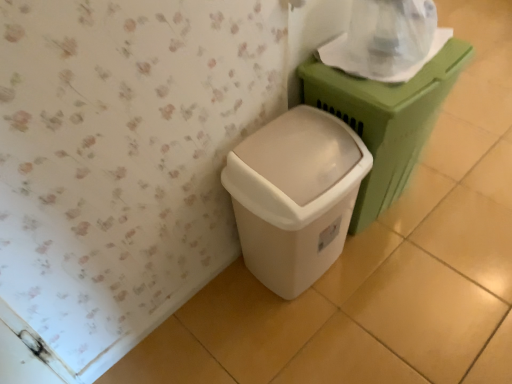
Question: Which direction should I rotate to look at white plastic waste container at lower center, the second waste container viewed from the right?

Choices:
 (A) left
 (B) right

Answer: (B)

Question: Considering the relative positions of transparent plastic toilet paper at upper right and matte green plastic at right, positioned as the 1th waste container in right-to-left order, in the image provided, is transparent plastic toilet paper at upper right to the right of matte green plastic at right, positioned as the 1th waste container in right-to-left order, from the viewer's perspective?

Choices:
 (A) yes
 (B) no

Answer: (B)

Question: Considering the relative sizes of transparent plastic toilet paper at upper right and matte green plastic at right, positioned as the 1th waste container in right-to-left order, in the image provided, is transparent plastic toilet paper at upper right shorter than matte green plastic at right, positioned as the 1th waste container in right-to-left order,?

Choices:
 (A) yes
 (B) no

Answer: (A)

Question: From a real-world perspective, is transparent plastic toilet paper at upper right located beneath matte green plastic at right, positioned as the 1th waste container in right-to-left order?

Choices:
 (A) yes
 (B) no

Answer: (B)

Question: From a real-world perspective, does transparent plastic toilet paper at upper right stand above matte green plastic at right, the 2th waste container from the left?

Choices:
 (A) no
 (B) yes

Answer: (B)

Question: Is transparent plastic toilet paper at upper right further to the viewer compared to matte green plastic at right, the 2th waste container from the left?

Choices:
 (A) no
 (B) yes

Answer: (B)

Question: Is transparent plastic toilet paper at upper right wider than matte green plastic at right, positioned as the 1th waste container in right-to-left order?

Choices:
 (A) yes
 (B) no

Answer: (B)

Question: Can we say white plastic waste container at lower center, the second waste container viewed from the right, lies outside transparent plastic toilet paper at upper right?

Choices:
 (A) no
 (B) yes

Answer: (B)

Question: From the image's perspective, is white plastic waste container at lower center, arranged as the first waste container when viewed from the left, on top of transparent plastic toilet paper at upper right?

Choices:
 (A) no
 (B) yes

Answer: (A)

Question: Is white plastic waste container at lower center, arranged as the first waste container when viewed from the left, far from transparent plastic toilet paper at upper right?

Choices:
 (A) yes
 (B) no

Answer: (B)

Question: Is white plastic waste container at lower center, the second waste container viewed from the right, taller than transparent plastic toilet paper at upper right?

Choices:
 (A) yes
 (B) no

Answer: (A)

Question: Does white plastic waste container at lower center, the second waste container viewed from the right, lie in front of transparent plastic toilet paper at upper right?

Choices:
 (A) yes
 (B) no

Answer: (A)

Question: From the image's perspective, is white plastic waste container at lower center, the second waste container viewed from the right, located beneath transparent plastic toilet paper at upper right?

Choices:
 (A) no
 (B) yes

Answer: (B)

Question: Can you confirm if white plastic waste container at lower center, the second waste container viewed from the right, is positioned to the left of matte green plastic at right, positioned as the 1th waste container in right-to-left order?

Choices:
 (A) no
 (B) yes

Answer: (B)